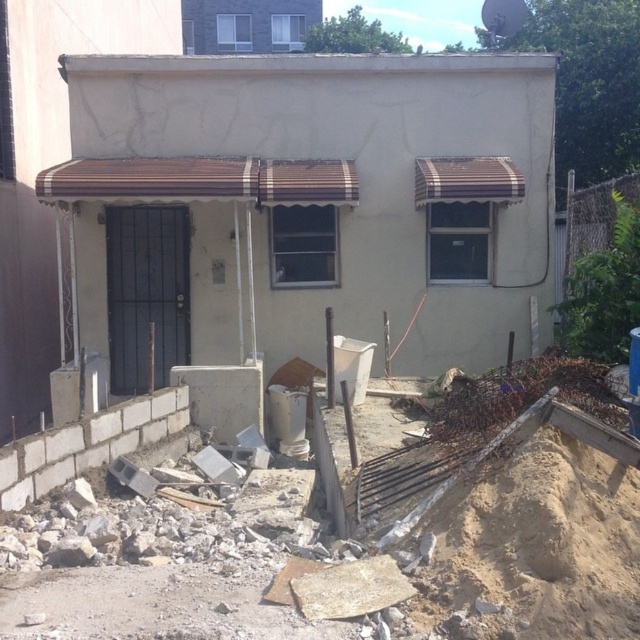
You are a delivery person trying to locate the beige stucco house at center. According to the coordinates provided, where would you find it in the image?

The beige stucco house at center is located at coordinates point (307, 205) in the image.